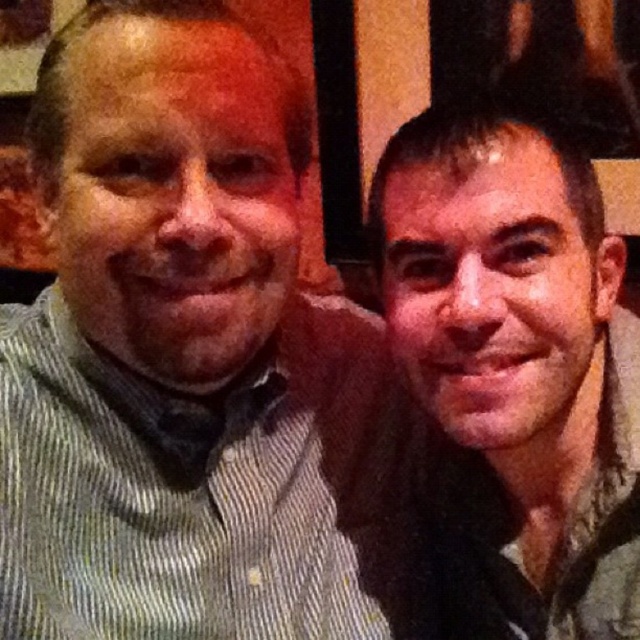
Can you confirm if striped cotton shirt at left is taller than matte gray scarf at right?

Indeed, striped cotton shirt at left has a greater height compared to matte gray scarf at right.

What do you see at coordinates (189, 360) in the screenshot? I see `striped cotton shirt at left` at bounding box center [189, 360].

Who is more distant from viewer, (x=90, y=422) or (x=563, y=438)?

Positioned behind is point (x=563, y=438).

This screenshot has width=640, height=640. Find the location of `striped cotton shirt at left`. striped cotton shirt at left is located at coordinates [189, 360].